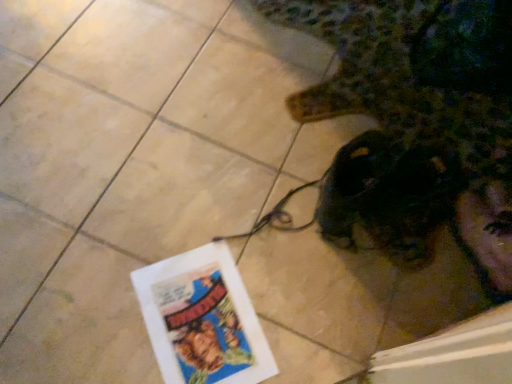
Where is `vacant region in front of shiny black headphones at lower right`? This screenshot has height=384, width=512. vacant region in front of shiny black headphones at lower right is located at coordinates (347, 289).